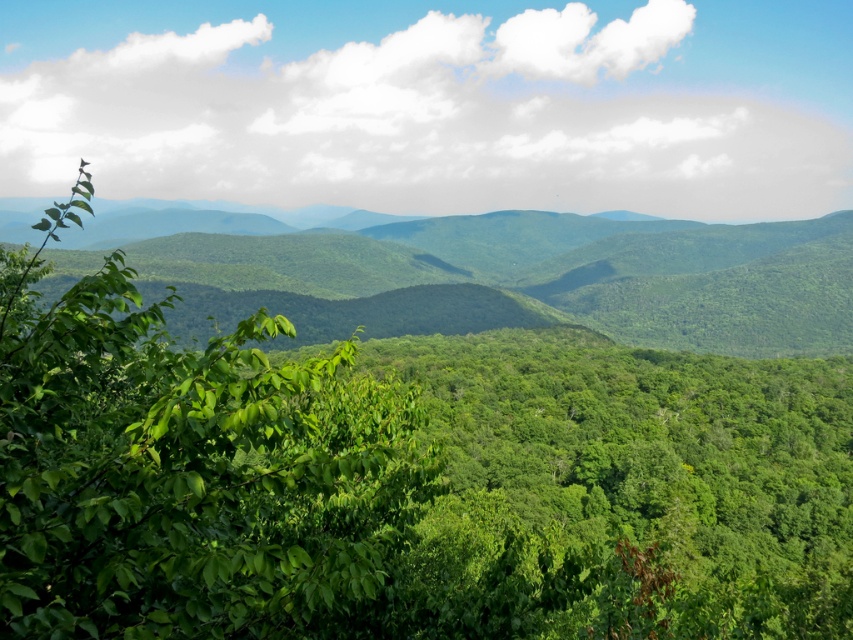
Question: Is green leafy tree at left behind green leafy forest at center?

Choices:
 (A) yes
 (B) no

Answer: (B)

Question: Is green leafy tree at left bigger than green leafy forest at center?

Choices:
 (A) yes
 (B) no

Answer: (B)

Question: Can you confirm if green leafy tree at left is smaller than green leafy forest at center?

Choices:
 (A) yes
 (B) no

Answer: (A)

Question: Which of the following is the farthest from the observer?

Choices:
 (A) green leafy forest at center
 (B) green leafy tree at left

Answer: (A)